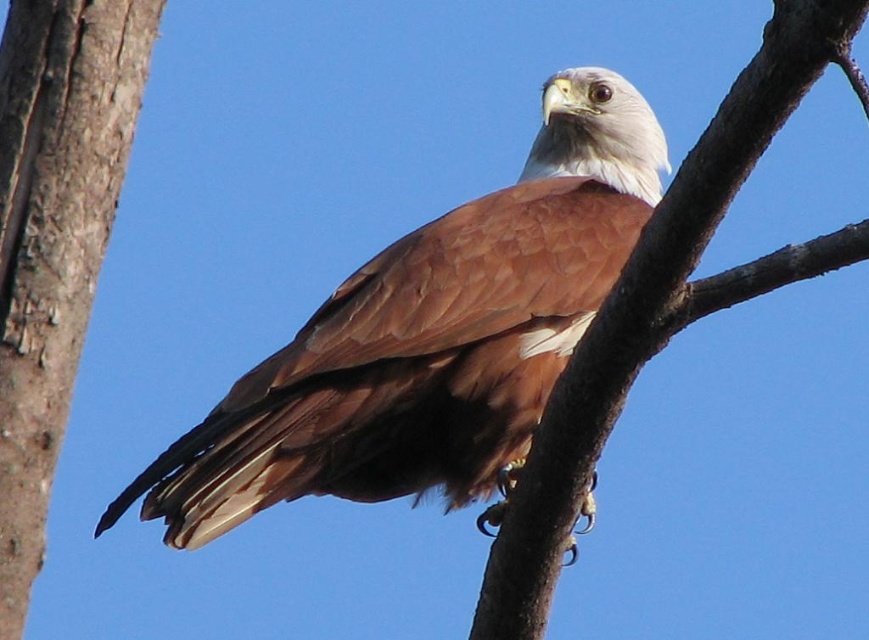
You are observing a hawk perched on a branch. There are two points marked in the image. The first point is at coordinates point (362, 349) and the second point is at point (44, 248). From your perspective, which point is closer to you?

Point (362, 349) is closer to the camera than point (44, 248).

You are standing 2 meters away from a tree. You see a point marked at coordinates point (34, 333). If you want to place a small bird feeder exactly at that point, will you be able to reach it without moving closer to the tree?

The distance of point (34, 333) from viewer is 3.96 meters. Since you are currently 2 meters away from the tree, you need to move an additional 1.96 meters closer to reach the point where the feeder needs to be placed.